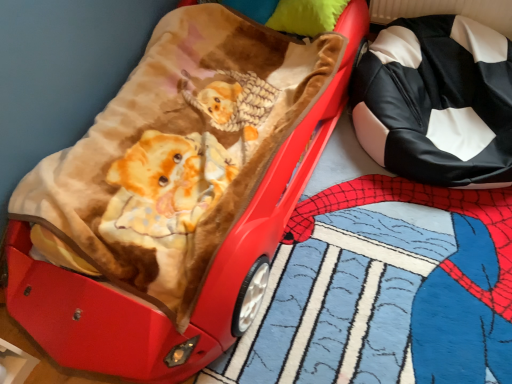
In order to click on velvet-like brown blanket at upper left in this screenshot , I will do `click(208, 274)`.

Image resolution: width=512 pixels, height=384 pixels. What do you see at coordinates (208, 274) in the screenshot?
I see `velvet-like brown blanket at upper left` at bounding box center [208, 274].

Based on the photo, measure the distance between velvet-like brown blanket at upper left and camera.

The depth of velvet-like brown blanket at upper left is 1.27 meters.

Describe the element at coordinates (437, 102) in the screenshot. I see `black/white leather pillow at right` at that location.

Identify the location of black/white leather pillow at right. (437, 102).

In order to face black/white leather pillow at right, should I rotate leftwards or rightwards?

To align with it, rotate right about 23.582°.

The image size is (512, 384). In order to click on velvet-like brown blanket at upper left in this screenshot , I will do `click(208, 274)`.

Based on their positions, is black/white leather pillow at right located to the left or right of velvet-like brown blanket at upper left?

From the image, it's evident that black/white leather pillow at right is to the right of velvet-like brown blanket at upper left.

Between black/white leather pillow at right and velvet-like brown blanket at upper left, which one is positioned behind?

black/white leather pillow at right is more distant.

Is point (445, 129) in front of point (219, 253)?

That is False.

Based on the photo, from the image's perspective, does black/white leather pillow at right appear higher than velvet-like brown blanket at upper left?

Indeed, from the image's perspective, black/white leather pillow at right is shown above velvet-like brown blanket at upper left.

From a real-world perspective, is black/white leather pillow at right above or below velvet-like brown blanket at upper left?

From a real-world perspective, black/white leather pillow at right is physically below velvet-like brown blanket at upper left.

Looking at their sizes, would you say black/white leather pillow at right is wider or thinner than velvet-like brown blanket at upper left?

Clearly, black/white leather pillow at right has less width compared to velvet-like brown blanket at upper left.

Considering the relative sizes of black/white leather pillow at right and velvet-like brown blanket at upper left in the image provided, is black/white leather pillow at right shorter than velvet-like brown blanket at upper left?

Correct, black/white leather pillow at right is not as tall as velvet-like brown blanket at upper left.

Is black/white leather pillow at right bigger or smaller than velvet-like brown blanket at upper left?

black/white leather pillow at right is smaller than velvet-like brown blanket at upper left.

Is black/white leather pillow at right situated inside velvet-like brown blanket at upper left or outside?

black/white leather pillow at right is not inside velvet-like brown blanket at upper left, it's outside.

Are black/white leather pillow at right and velvet-like brown blanket at upper left beside each other?

black/white leather pillow at right is not next to velvet-like brown blanket at upper left, and they're not touching.

Is black/white leather pillow at right aimed at velvet-like brown blanket at upper left?

No, black/white leather pillow at right is not aimed at velvet-like brown blanket at upper left.

Can you tell me how much black/white leather pillow at right and velvet-like brown blanket at upper left differ in facing direction?

The angular difference between black/white leather pillow at right and velvet-like brown blanket at upper left is 1.49 degrees.

In order to click on furniture on the left of black/white leather pillow at right in this screenshot , I will do `click(208, 274)`.

Does velvet-like brown blanket at upper left appear on the left side of black/white leather pillow at right?

Yes, velvet-like brown blanket at upper left is to the left of black/white leather pillow at right.

Is velvet-like brown blanket at upper left in front of or behind black/white leather pillow at right in the image?

Clearly, velvet-like brown blanket at upper left is in front of black/white leather pillow at right.

Is point (291, 134) positioned after point (480, 101)?

No, (291, 134) is closer to viewer.

From the image's perspective, is velvet-like brown blanket at upper left positioned above or below black/white leather pillow at right?

Based on their image positions, velvet-like brown blanket at upper left is located beneath black/white leather pillow at right.

From a real-world perspective, who is located lower, velvet-like brown blanket at upper left or black/white leather pillow at right?

From a 3D spatial view, black/white leather pillow at right is below.

From the picture: In terms of width, does velvet-like brown blanket at upper left look wider or thinner when compared to black/white leather pillow at right?

In the image, velvet-like brown blanket at upper left appears to be wider than black/white leather pillow at right.

From their relative heights in the image, would you say velvet-like brown blanket at upper left is taller or shorter than black/white leather pillow at right?

In the image, velvet-like brown blanket at upper left appears to be taller than black/white leather pillow at right.

In the scene shown: Is velvet-like brown blanket at upper left bigger than black/white leather pillow at right?

Correct, velvet-like brown blanket at upper left is larger in size than black/white leather pillow at right.

Is velvet-like brown blanket at upper left surrounding black/white leather pillow at right?

Definitely not — black/white leather pillow at right is not inside velvet-like brown blanket at upper left.

Are velvet-like brown blanket at upper left and black/white leather pillow at right making contact?

No, velvet-like brown blanket at upper left is not beside black/white leather pillow at right.

Could you tell me if velvet-like brown blanket at upper left is facing black/white leather pillow at right?

No, velvet-like brown blanket at upper left is not aimed at black/white leather pillow at right.

How many degrees apart are the facing directions of velvet-like brown blanket at upper left and black/white leather pillow at right?

The angular difference between velvet-like brown blanket at upper left and black/white leather pillow at right is 1.49 degrees.

Measure the distance from velvet-like brown blanket at upper left to black/white leather pillow at right.

velvet-like brown blanket at upper left and black/white leather pillow at right are 20.88 inches apart from each other.

Where is `pillow directly beneath the velvet-like brown blanket at upper left (from a real-world perspective)`? The height and width of the screenshot is (384, 512). pillow directly beneath the velvet-like brown blanket at upper left (from a real-world perspective) is located at coordinates (437, 102).

The image size is (512, 384). I want to click on pillow on the right of velvet-like brown blanket at upper left, so click(x=437, y=102).

Locate an element on the screen. The image size is (512, 384). pillow above the velvet-like brown blanket at upper left (from the image's perspective) is located at coordinates (437, 102).